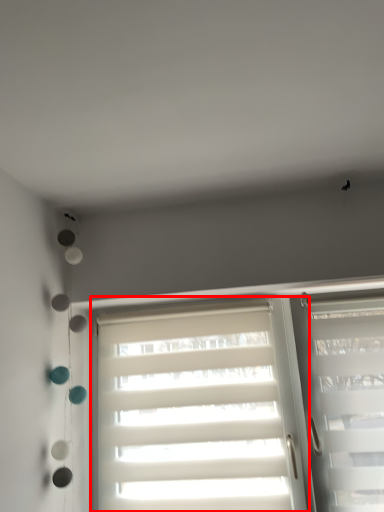
Question: In this image, where is window (annotated by the red box) located relative to window?

Choices:
 (A) right
 (B) left

Answer: (B)